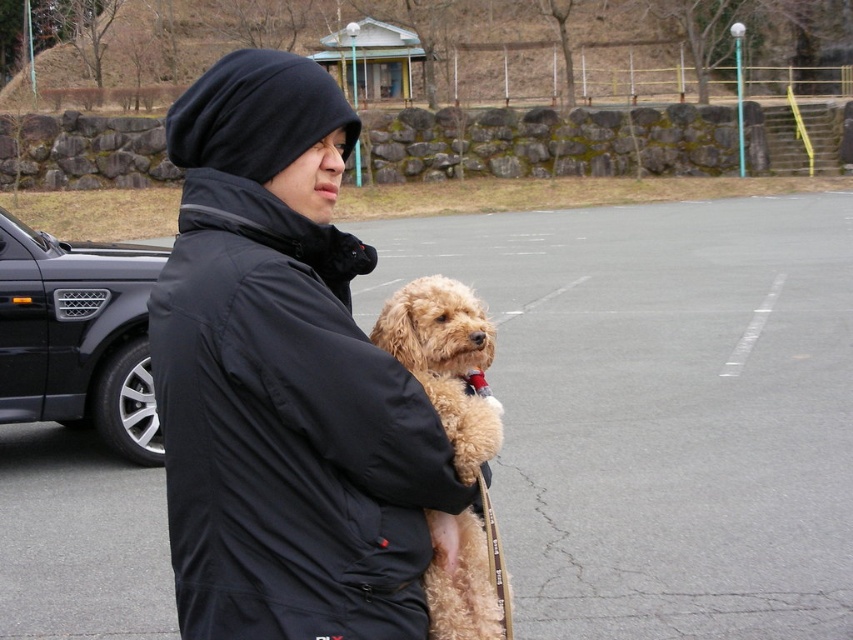
Is point (654, 218) less distant than point (3, 243)?

No, (654, 218) is further to viewer.

Who is positioned more to the left, gray asphalt parking lot at center or black metallic car at left?

black metallic car at left

Is point (21, 540) positioned behind point (120, 454)?

No, (21, 540) is in front of (120, 454).

You are a GUI agent. You are given a task and a screenshot of the screen. Output one action in this format:
    pyautogui.click(x=<x>, y=<y>)
    Task: Click on the gray asphalt parking lot at center
    The width and height of the screenshot is (853, 640).
    Given the screenshot: What is the action you would take?
    pyautogui.click(x=662, y=408)

Is black matte jacket at center above black metallic car at left?

Indeed, black matte jacket at center is positioned over black metallic car at left.

Who is more forward, (260, 419) or (51, 326)?

Point (260, 419)

You are a GUI agent. You are given a task and a screenshot of the screen. Output one action in this format:
    pyautogui.click(x=<x>, y=<y>)
    Task: Click on the black matte jacket at center
    
    Given the screenshot: What is the action you would take?
    pyautogui.click(x=283, y=380)

Identify the location of black matte jacket at center. (283, 380).

Does black matte jacket at center come behind fuzzy beige dog at center?

No, it is not.

Does black matte jacket at center appear on the right side of fuzzy beige dog at center?

In fact, black matte jacket at center is to the left of fuzzy beige dog at center.

Who is more forward, (401, 397) or (445, 548)?

Point (401, 397)

Where is `black matte jacket at center`? This screenshot has height=640, width=853. black matte jacket at center is located at coordinates (283, 380).